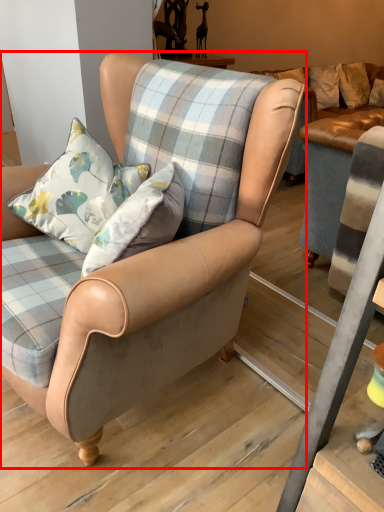
Question: From the image's perspective, considering the relative positions of chair (annotated by the red box) and pillow in the image provided, where is chair (annotated by the red box) located with respect to the staircase?

Choices:
 (A) below
 (B) above

Answer: (A)